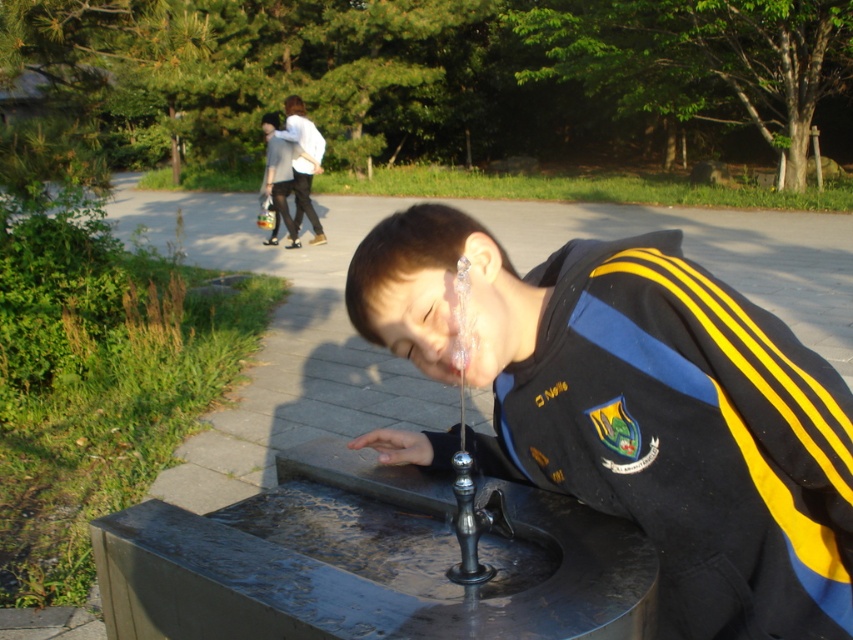
Question: Which object is farther from the camera taking this photo?

Choices:
 (A) polished metal faucet at center
 (B) shiny black jacket at center

Answer: (A)

Question: Does shiny black jacket at center lie in front of polished metal faucet at center?

Choices:
 (A) yes
 (B) no

Answer: (A)

Question: Is shiny black jacket at center to the left of polished metal faucet at center from the viewer's perspective?

Choices:
 (A) no
 (B) yes

Answer: (A)

Question: Which point is farther from the camera taking this photo?

Choices:
 (A) (728, 522)
 (B) (473, 488)

Answer: (B)

Question: Can you confirm if shiny black jacket at center is positioned to the left of polished metal faucet at center?

Choices:
 (A) yes
 (B) no

Answer: (B)